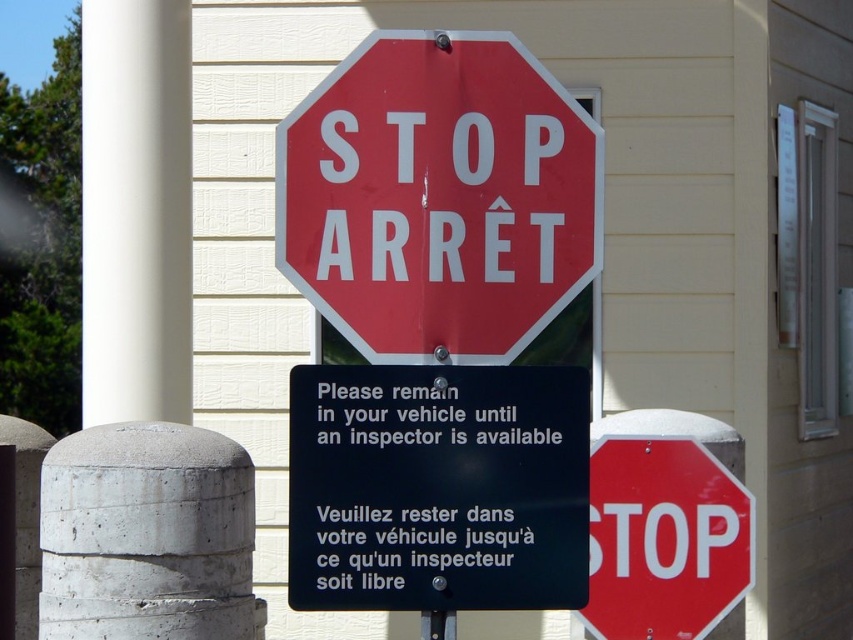
You are a delivery driver who needs to attach a new sign to the pole. The new sign is the same size as the black plastic sign at center. Will the new sign fit on the metallic pole at center without overlapping the existing sign?

The black plastic sign at center is larger in size than metallic pole at center. Since the new sign is the same size as the black plastic sign at center, it will not fit on the metallic pole at center without overlapping the existing sign because the pole is smaller in diameter than the sign.

You are driving a car and need to know which object is closer to you between the black plastic sign at center and the metallic pole at center. Based on the scene description, which one is closer?

The black plastic sign at center is closer to you because it is in front of the metallic pole at center, indicating that it is positioned nearer in the visual plane.

You are a driver approaching the stop sign and need to determine if the black plastic sign at center is attached to the metallic pole at center. Based on the scene description, can you confirm this?

The black plastic sign at center is positioned over the metallic pole at center, which suggests that it is attached to the pole.